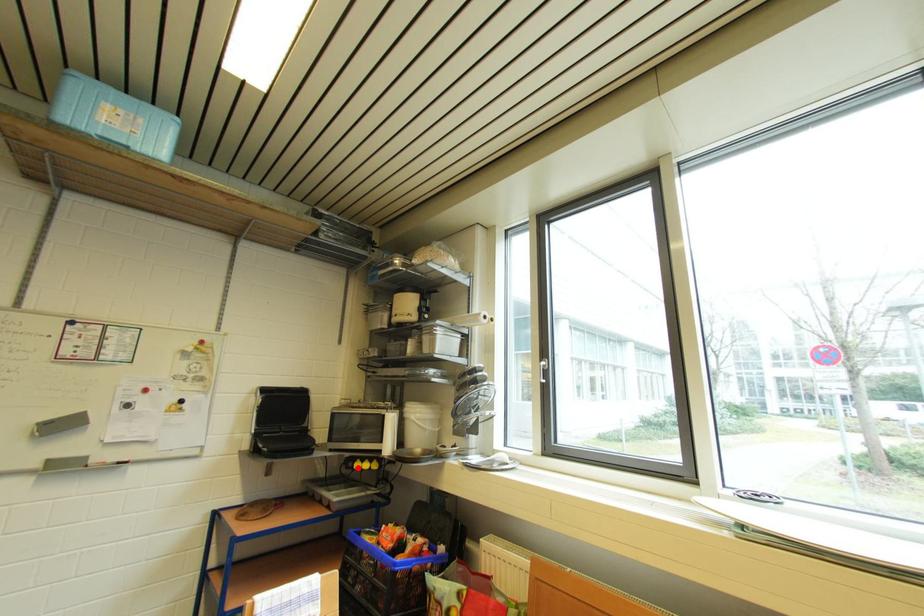
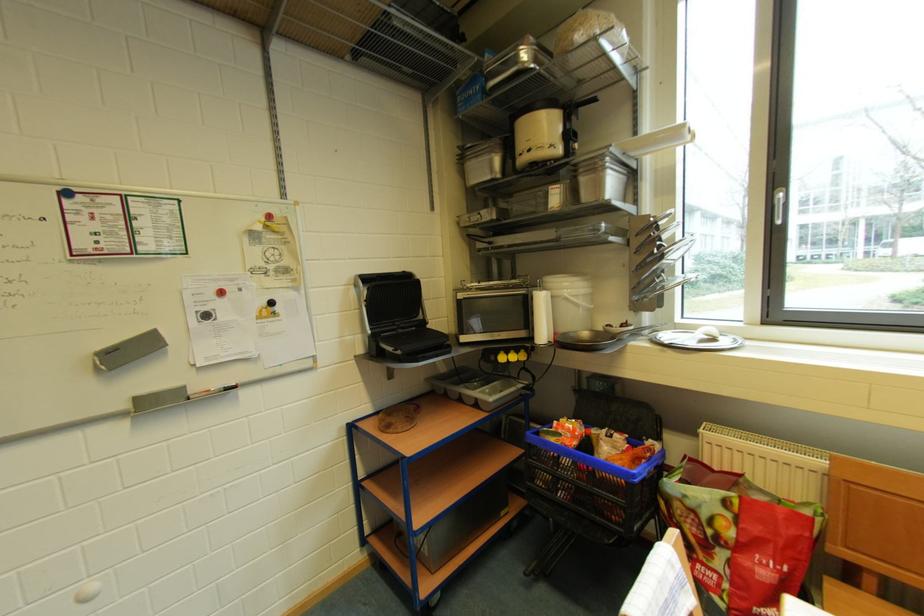
In the second image, find the point that corresponds to the highlighted location in the first image.

(500, 361)